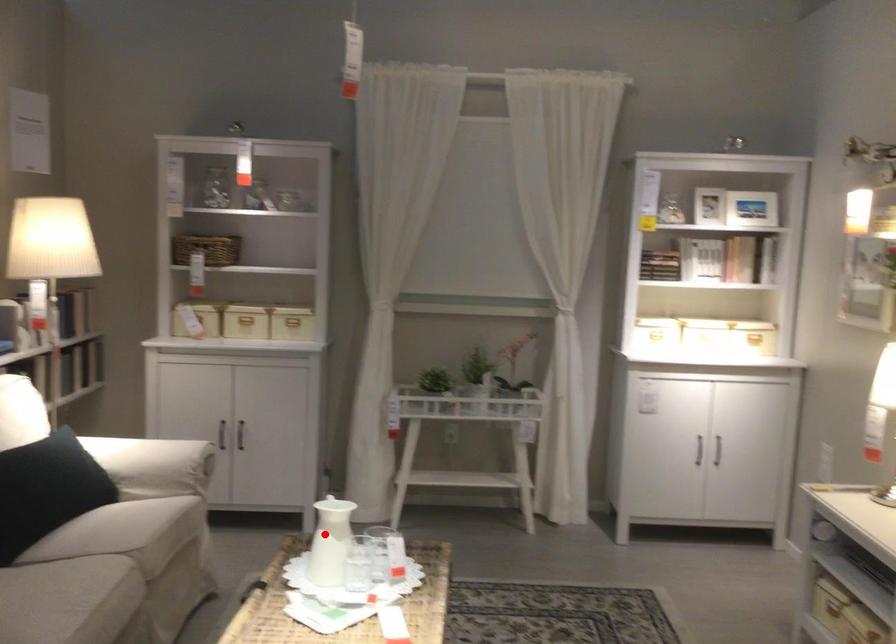
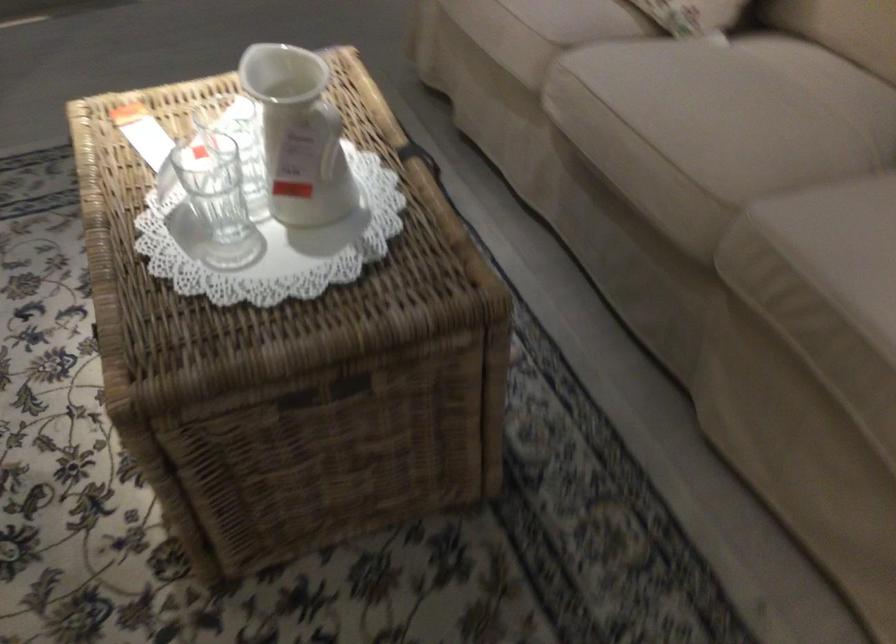
Question: I am providing you with two images of the same scene from different viewpoints. Given a red point in image1, look at the same physical point in image2. Is it:

Choices:
 (A) Closer to the viewpoint
 (B) Farther from the viewpoint

Answer: (A)